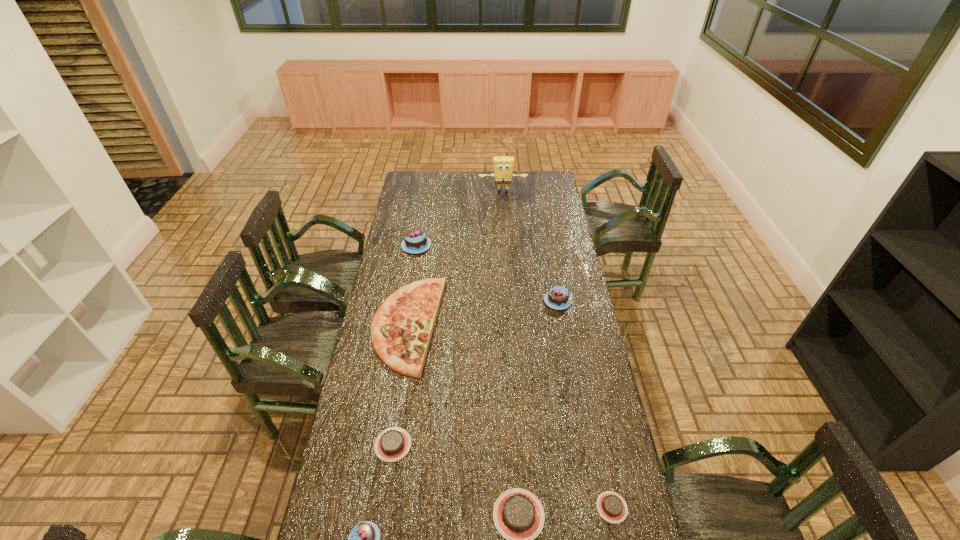
Find the location of `blank space at the right edge of the desktop`. blank space at the right edge of the desktop is located at coordinates (x=575, y=341).

The width and height of the screenshot is (960, 540). In order to click on free space at the far left corner of the desktop in this screenshot , I will do `click(429, 176)`.

Identify the location of vacant space at the far right corner of the desktop. (534, 172).

What are the coordinates of `unoccupied area between the second farthest chocolate cake and the rightmost brown chocolate cake` in the screenshot? It's located at (585, 404).

I want to click on blank region between the biggest pink chocolate cake and the second farthest pink chocolate cake, so click(487, 273).

At what (x,y) coordinates should I click in order to perform the action: click on unoccupied area between the third farthest chocolate cake and the shortest chocolate cake. Please return your answer as a coordinate pair (x, y). The height and width of the screenshot is (540, 960). Looking at the image, I should click on (502, 476).

This screenshot has height=540, width=960. I want to click on free space between the second farthest chocolate cake and the shortest chocolate cake, so click(585, 404).

Where is `free spot between the second tallest chocolate cake and the pizza`? free spot between the second tallest chocolate cake and the pizza is located at coordinates (483, 313).

Locate an element on the screen. Image resolution: width=960 pixels, height=540 pixels. empty space that is in between the biggest pink chocolate cake and the rightmost pink chocolate cake is located at coordinates (487, 273).

Select which object is the sixth closest to the second brown chocolate cake from left to right. Please provide its 2D coordinates. Your answer should be formatted as a tuple, i.e. [(x, y)], where the tuple contains the x and y coordinates of a point satisfying the conditions above.

[(415, 241)]